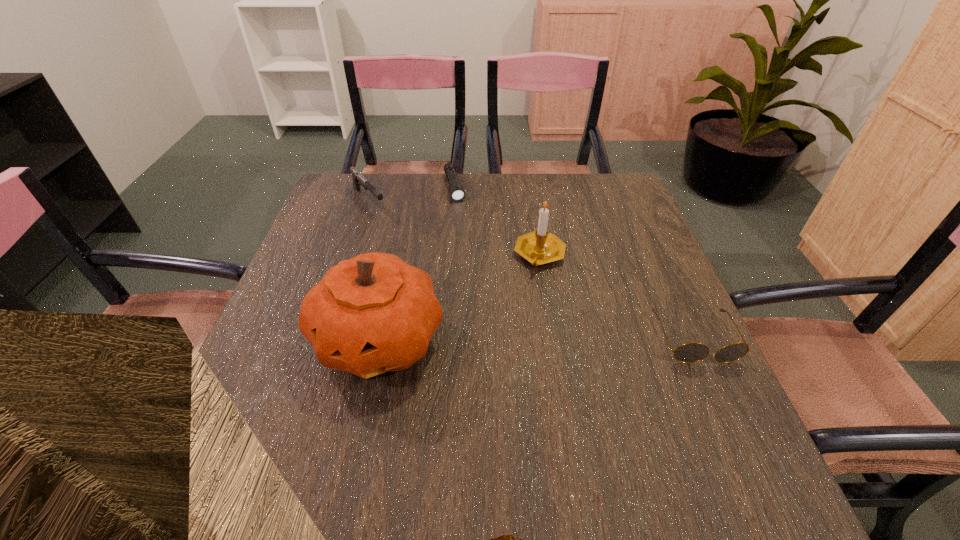
The width and height of the screenshot is (960, 540). What are the coordinates of `vacant space located at the muzzle end of the third shortest object` in the screenshot? It's located at (447, 287).

What are the coordinates of `free point located at the muzzle end of the third shortest object` in the screenshot? It's located at (425, 265).

You are a GUI agent. You are given a task and a screenshot of the screen. Output one action in this format:
    pyautogui.click(x=<x>, y=<y>)
    Task: Click on the free space located at the lens end of the shortest object
    Image resolution: width=960 pixels, height=540 pixels.
    Given the screenshot: What is the action you would take?
    pyautogui.click(x=485, y=296)

At what (x,y) coordinates should I click in order to perform the action: click on free space located at the lens end of the shortest object. Please return your answer as a coordinate pair (x, y). Looking at the image, I should click on (482, 287).

You are a GUI agent. You are given a task and a screenshot of the screen. Output one action in this format:
    pyautogui.click(x=<x>, y=<y>)
    Task: Click on the blank space located at the lens end of the shortest object
    The image size is (960, 540).
    Given the screenshot: What is the action you would take?
    pyautogui.click(x=460, y=216)

Image resolution: width=960 pixels, height=540 pixels. I want to click on free spot located 0.060m with a handle on the fourth object from left to right, so click(x=552, y=293).

Identify the location of free location located with a handle on the fourth object from left to right. (580, 370).

Locate an element on the screen. Image resolution: width=960 pixels, height=540 pixels. free space located with a handle on the fourth object from left to right is located at coordinates (554, 295).

At what (x,y) coordinates should I click in order to perform the action: click on gun that is at the far edge. Please return your answer as a coordinate pair (x, y). This screenshot has width=960, height=540. Looking at the image, I should click on (358, 180).

The height and width of the screenshot is (540, 960). Find the location of `flashlight that is at the far edge`. flashlight that is at the far edge is located at coordinates (457, 193).